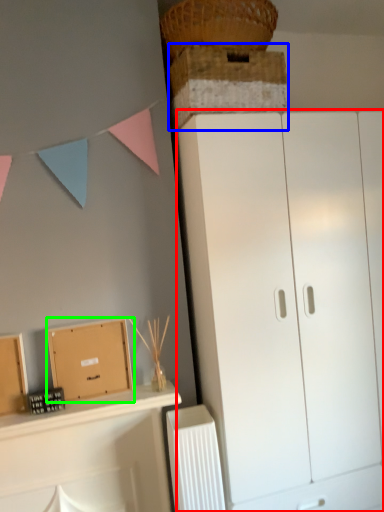
Question: Based on their relative distances, which object is nearer to cupboard (highlighted by a red box)? Choose from cabinetry (highlighted by a blue box) and cardboard box (highlighted by a green box).

Choices:
 (A) cabinetry
 (B) cardboard box

Answer: (A)